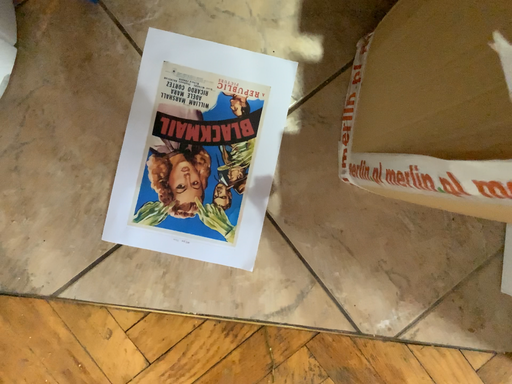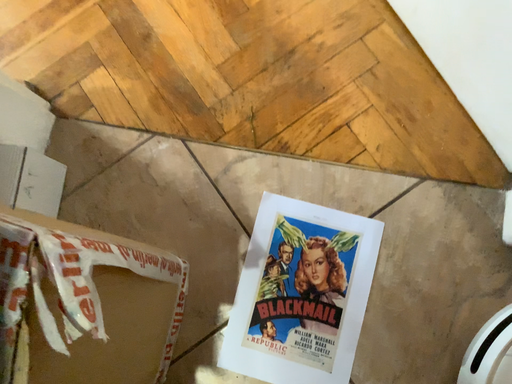
Question: How did the camera likely rotate when shooting the video?

Choices:
 (A) rotated upward
 (B) rotated downward

Answer: (A)